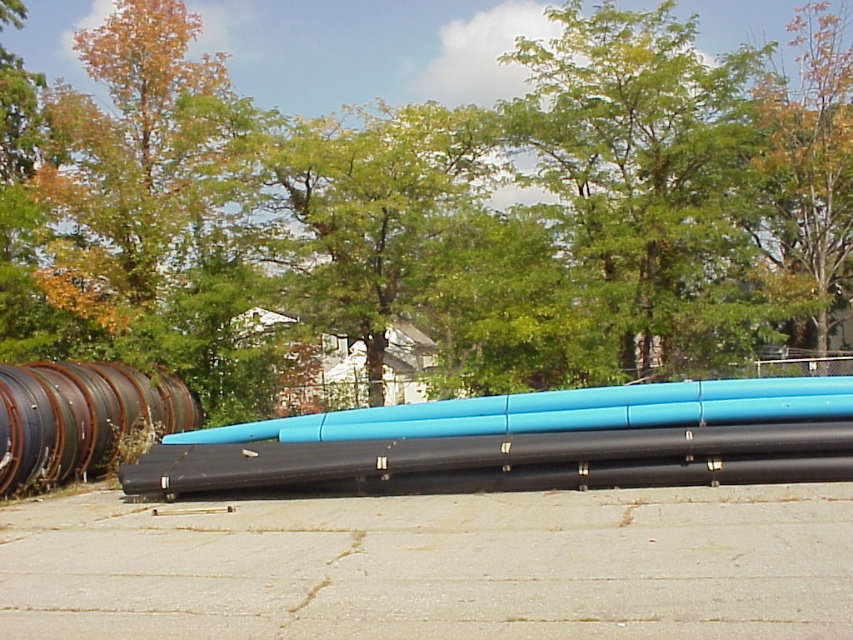
You are standing at a point 7.53 meters away from the camera, which is marked as point (x=364, y=630) in the image. You want to walk towards the dense trees in the background. Are you currently closer to the black pipes or the blue pipes?

The point (x=364, y=630) is 7.53 meters away from the camera. Since the pipes are lying on the concrete surface in front of the trees, you are closer to the pipes than the trees. However, the description does not specify the position of the black and blue pipes relative to the point, so it is impossible to determine which color pipes are closer.

You are standing in the outdoor area where the pipes are arranged. You notice two points marked in the scene. From your perspective, which point is closer to you, point (819, 42) or point (659, 388)?

Point (659, 388) is closer to you because it is less further to the camera than point (819, 42) according to the description.